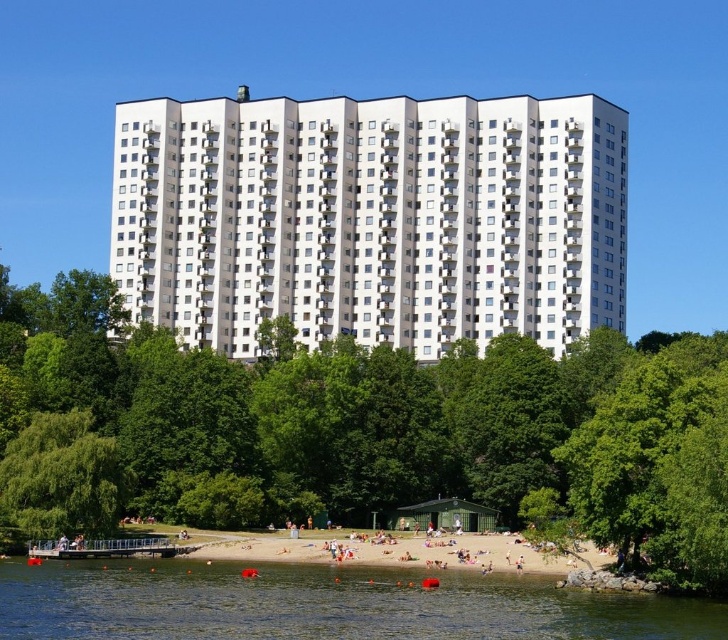
Does green leafy tree at center have a smaller size compared to metallic silver boat at lower center?

Incorrect, green leafy tree at center is not smaller in size than metallic silver boat at lower center.

Consider the image. Can you confirm if green leafy tree at center is taller than metallic silver boat at lower center?

Indeed, green leafy tree at center has a greater height compared to metallic silver boat at lower center.

Identify the location of green leafy tree at center. (381, 429).

The image size is (728, 640). I want to click on green leafy tree at center, so click(x=381, y=429).

Can you confirm if green leafy tree at lower left is thinner than metallic silver boat at lower center?

No, green leafy tree at lower left is not thinner than metallic silver boat at lower center.

Between green leafy tree at lower left and metallic silver boat at lower center, which one has less height?

With less height is metallic silver boat at lower center.

Does point (15, 458) come in front of point (47, 554)?

No, it is behind (47, 554).

The width and height of the screenshot is (728, 640). What are the coordinates of `green leafy tree at lower left` in the screenshot? It's located at (63, 477).

Is green leafy tree at center in front of green leafy tree at lower left?

Yes, it is.

Which is more to the right, green leafy tree at center or green leafy tree at lower left?

green leafy tree at center is more to the right.

Who is more forward, (494, 408) or (50, 460)?

Point (50, 460)

Identify the location of green leafy tree at center. The width and height of the screenshot is (728, 640). (381, 429).